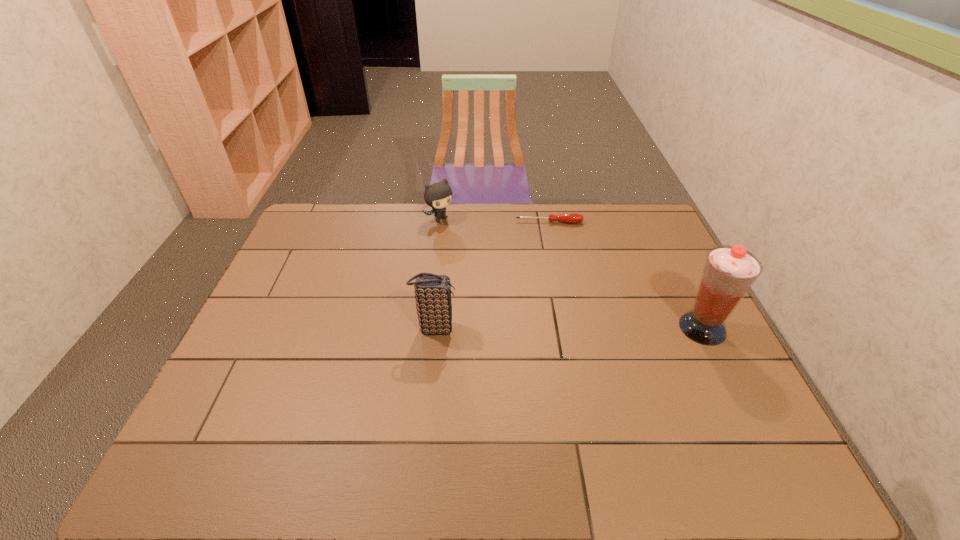
Locate an element on the screen. vacant position located on the front-facing side of the third tallest object is located at coordinates 465,239.

Where is `vacant space situated 0.250m at the tip of the shortest object`? vacant space situated 0.250m at the tip of the shortest object is located at coordinates (556, 272).

You are a GUI agent. You are given a task and a screenshot of the screen. Output one action in this format:
    pyautogui.click(x=<x>, y=<y>)
    Task: Click on the free spot located at the tip of the shortest object
    
    Given the screenshot: What is the action you would take?
    pyautogui.click(x=559, y=289)

Identify the location of free space located at the tip of the shortest object. Image resolution: width=960 pixels, height=540 pixels. (555, 266).

At what (x,y) coordinates should I click in order to perform the action: click on kitten located in the far edge section of the desktop. Please return your answer as a coordinate pair (x, y). The height and width of the screenshot is (540, 960). Looking at the image, I should click on [x=438, y=195].

This screenshot has width=960, height=540. I want to click on screwdriver situated at the far edge, so click(x=569, y=217).

The width and height of the screenshot is (960, 540). What are the coordinates of `object present at the right edge` in the screenshot? It's located at (729, 272).

The height and width of the screenshot is (540, 960). What are the coordinates of `vacant space at the far edge` in the screenshot? It's located at (415, 220).

You are a GUI agent. You are given a task and a screenshot of the screen. Output one action in this format:
    pyautogui.click(x=<x>, y=<y>)
    Task: Click on the blank space at the near edge of the desktop
    This screenshot has height=540, width=960.
    Given the screenshot: What is the action you would take?
    pyautogui.click(x=630, y=395)

In the image, there is a desktop. What are the coordinates of `vacant space at the left edge` in the screenshot? It's located at (276, 390).